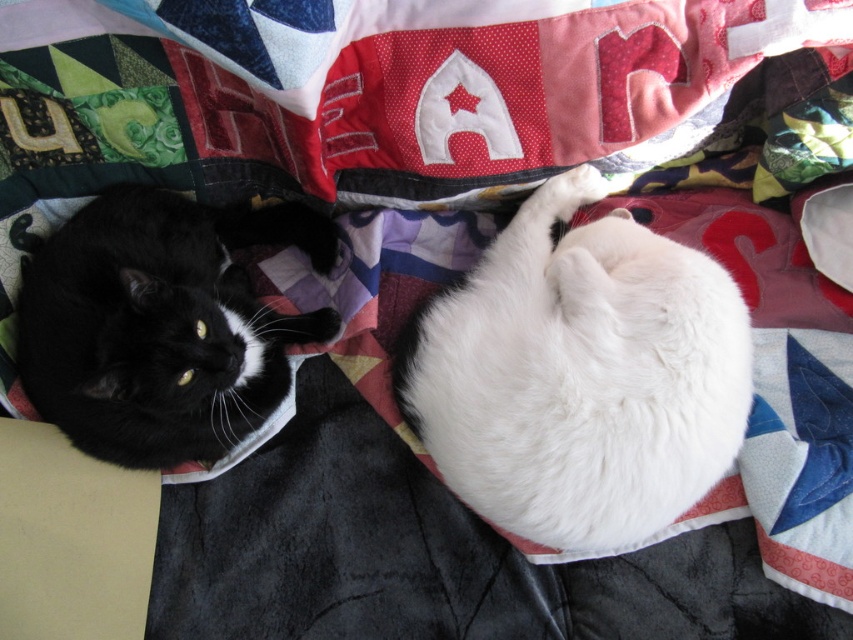
Question: Among these points, which one is nearest to the camera?

Choices:
 (A) (503, 516)
 (B) (274, 216)

Answer: (A)

Question: Which point is farther from the camera taking this photo?

Choices:
 (A) (608, 300)
 (B) (62, 426)

Answer: (B)

Question: Is white fluffy cat at center to the right of black fur cat at left from the viewer's perspective?

Choices:
 (A) yes
 (B) no

Answer: (A)

Question: Considering the relative positions of white fluffy cat at center and black fur cat at left in the image provided, where is white fluffy cat at center located with respect to black fur cat at left?

Choices:
 (A) above
 (B) below

Answer: (B)

Question: Can you confirm if white fluffy cat at center is positioned to the right of black fur cat at left?

Choices:
 (A) yes
 (B) no

Answer: (A)